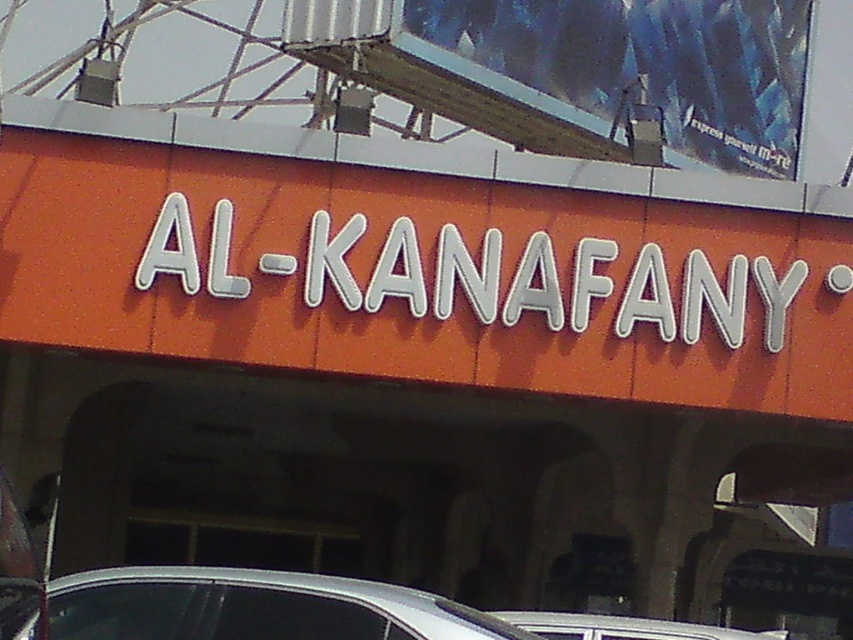
Which is more to the left, metallic blue billboard at upper right or white plastic car at center?

white plastic car at center

Can you confirm if metallic blue billboard at upper right is positioned to the left of white plastic car at center?

No, metallic blue billboard at upper right is not to the left of white plastic car at center.

Between point (747, 115) and point (669, 630), which one is positioned in front?

Positioned in front is point (669, 630).

Find the location of `metallic blue billboard at upper right`. metallic blue billboard at upper right is located at coordinates (628, 74).

Who is more forward, (750, 22) or (160, 595)?

Point (160, 595) is more forward.

Does point (740, 58) come in front of point (200, 620)?

No, it is behind (200, 620).

In order to click on metallic blue billboard at upper right in this screenshot , I will do `click(628, 74)`.

Locate an element on the screen. This screenshot has height=640, width=853. orange matte sign at center is located at coordinates (421, 275).

Between point (142, 278) and point (751, 152), which one is positioned behind?

Positioned behind is point (751, 152).

Locate an element on the screen. The image size is (853, 640). orange matte sign at center is located at coordinates 421,275.